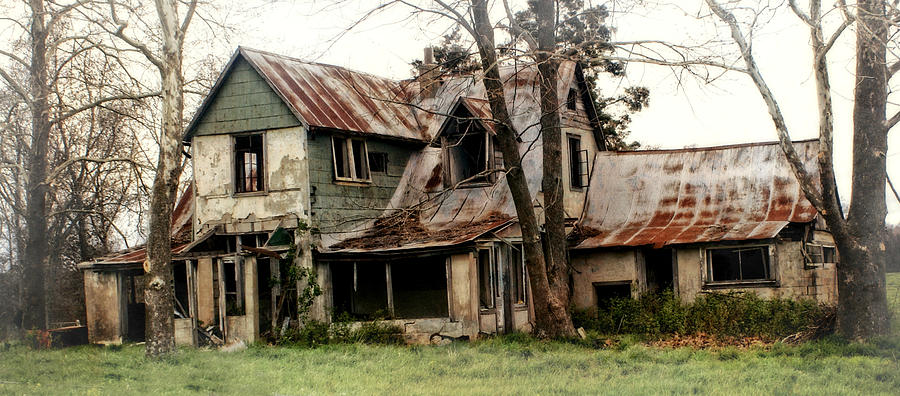
This screenshot has height=396, width=900. What are the coordinates of `second floor window` in the screenshot? It's located at (238, 166), (347, 152), (576, 155).